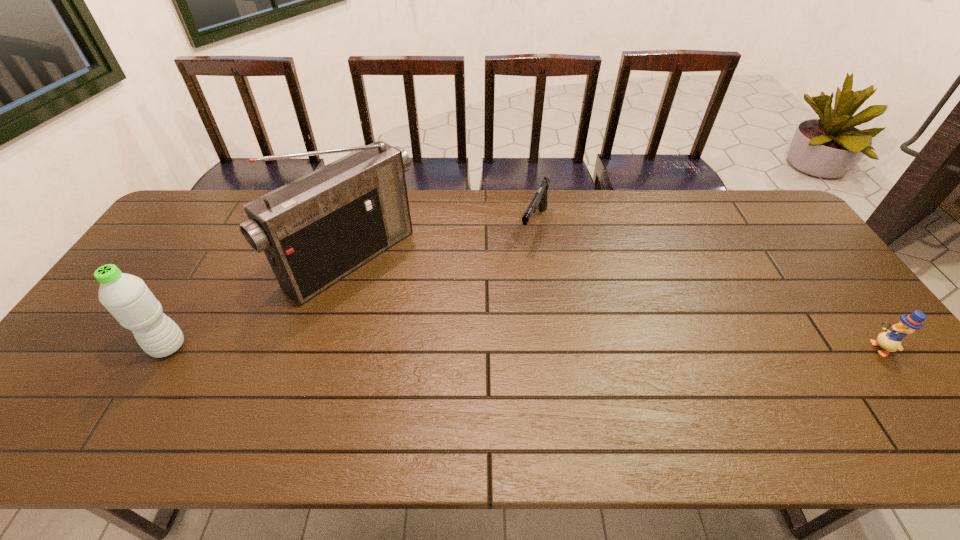
The image size is (960, 540). What are the coordinates of `vacant position located at the aiming end of the second object from right to left` in the screenshot? It's located at (513, 284).

I want to click on free space located 0.140m at the aiming end of the second object from right to left, so click(516, 277).

At what (x,y) coordinates should I click in order to perform the action: click on free space located 0.170m at the aiming end of the second object from right to left. Please return your answer as a coordinate pair (x, y). This screenshot has width=960, height=540. Looking at the image, I should click on (513, 284).

I want to click on vacant space located on the front-facing side of the third object from right to left, so click(468, 351).

The image size is (960, 540). Find the location of `vacant space located on the front-facing side of the third object from right to left`. vacant space located on the front-facing side of the third object from right to left is located at coordinates (465, 349).

Where is `free space located on the front-facing side of the third object from right to left`? The width and height of the screenshot is (960, 540). free space located on the front-facing side of the third object from right to left is located at coordinates (421, 316).

Identify the location of gun at the far edge. (539, 200).

Locate an element on the screen. The width and height of the screenshot is (960, 540). radio receiver that is positioned at the far edge is located at coordinates (316, 230).

Find the location of a particular element. This screenshot has height=540, width=960. object positioned at the right edge is located at coordinates (891, 341).

Find the location of a particular element. The height and width of the screenshot is (540, 960). free space at the far edge of the desktop is located at coordinates (456, 218).